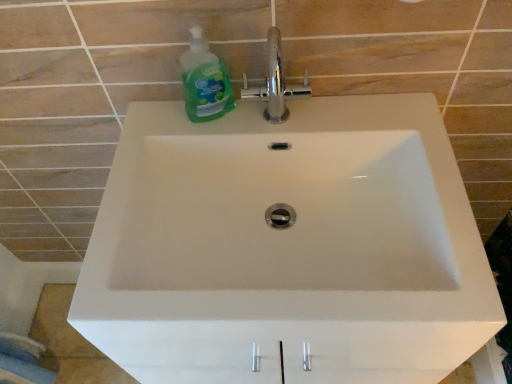
This screenshot has height=384, width=512. What are the coordinates of `vacant area that lies to the right of green translucent liquid soap at upper left` in the screenshot? It's located at (317, 128).